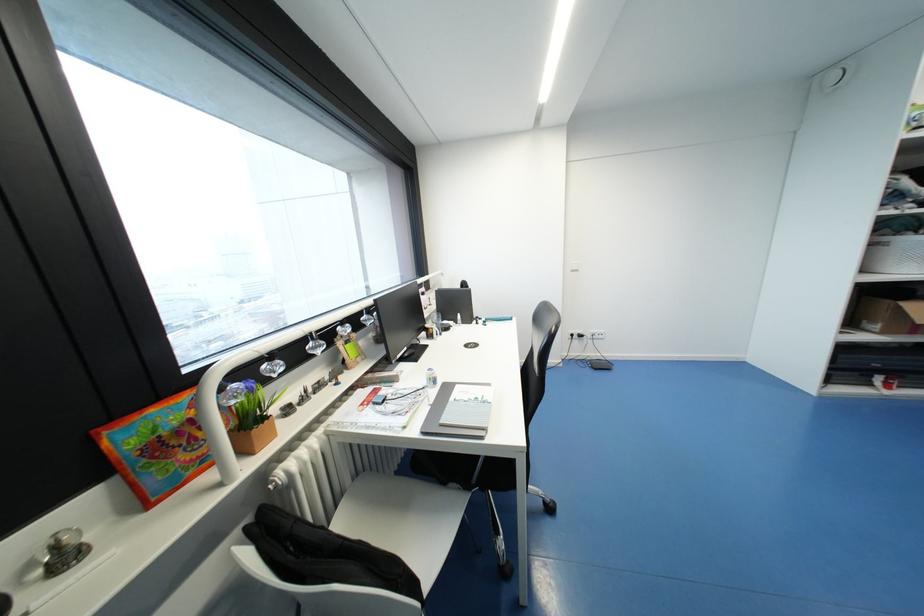
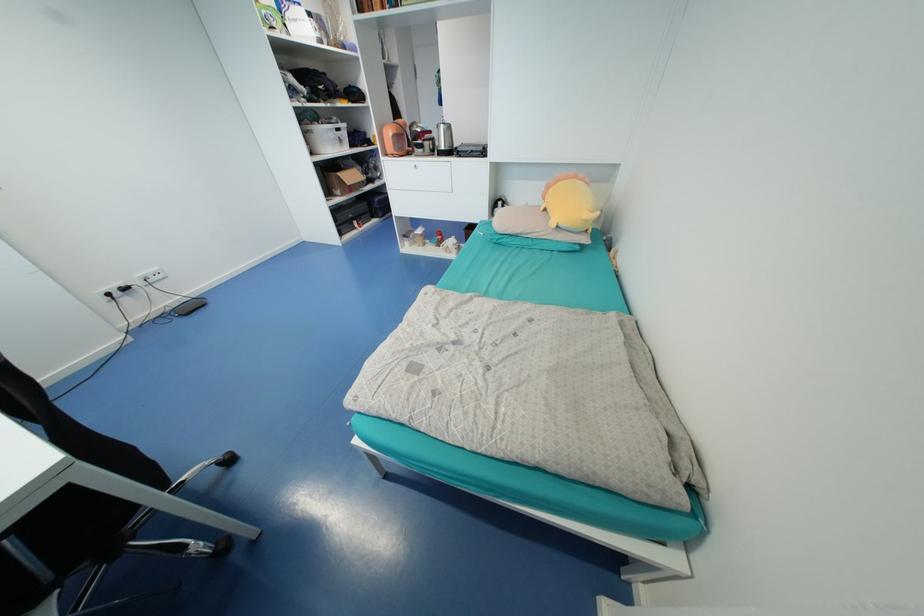
The point at (878, 323) is marked in the first image. Where is the corresponding point in the second image?

(341, 190)